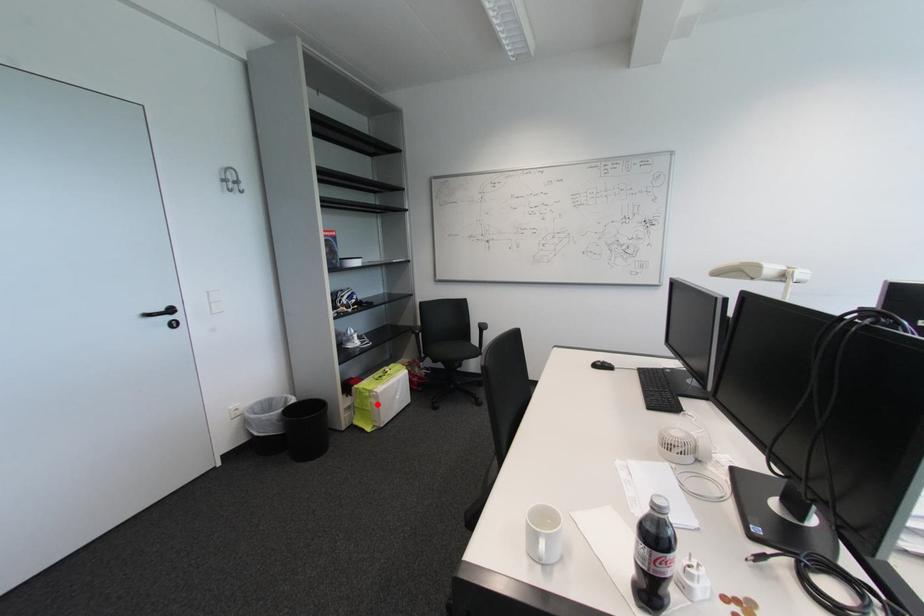
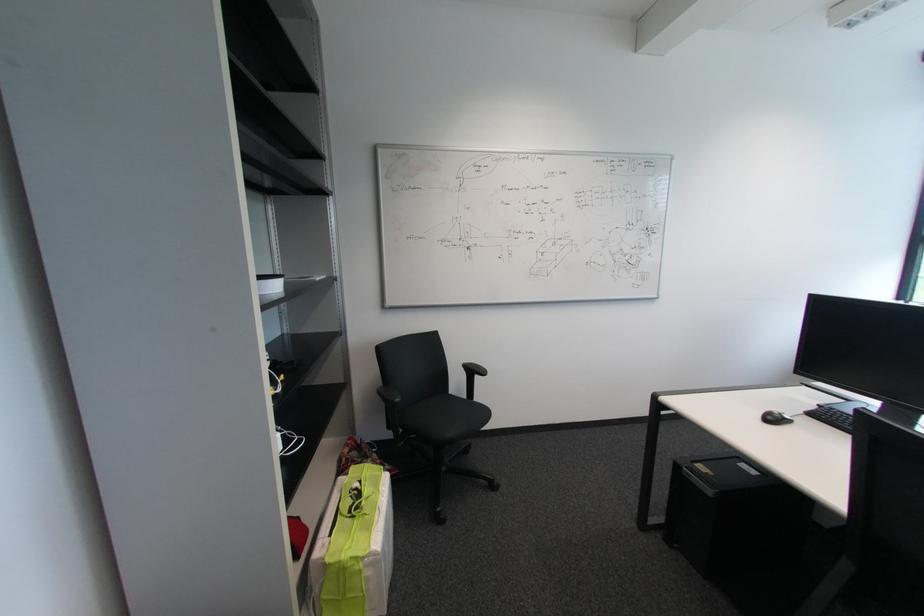
The point at the highlighted location is marked in the first image. Where is the corresponding point in the second image?

(372, 581)